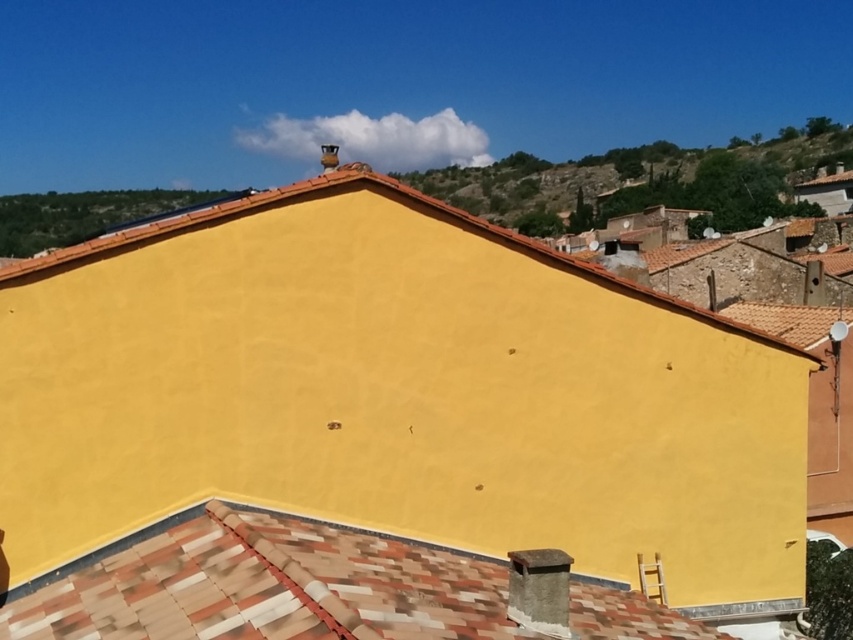
You are standing in front of the yellow wall and want to reach both points on it. Which point, point (x=173, y=556) or point (x=277, y=196), will you reach first?

Point (x=173, y=556) is closer to the viewer than point (x=277, y=196), so you will reach point (x=173, y=556) first.

You are an architect designing a new building. You need to install a solar panel that requires 1 meter of vertical space. The solar panel must be placed between the terracotta tiles at center and the matte yellow wall at upper center. Can the space between them accommodate the solar panel vertically?

The terracotta tiles at center has a lesser height compared to matte yellow wall at upper center, so the vertical space between them is insufficient to accommodate a solar panel requiring 1 meter of vertical space.

You are standing in front of a building and see the matte yellow wall at center and the terracotta tiles at center. Which object is closer to you?

The matte yellow wall at center is closer to you because it is positioned in front of the terracotta tiles at center.